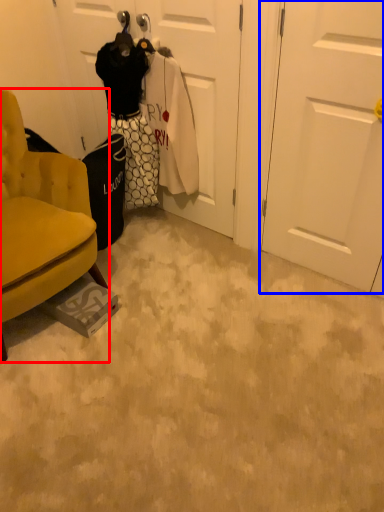
Question: Which object appears farthest to the camera in this image, chair (highlighted by a red box) or door (highlighted by a blue box)?

Choices:
 (A) chair
 (B) door

Answer: (B)